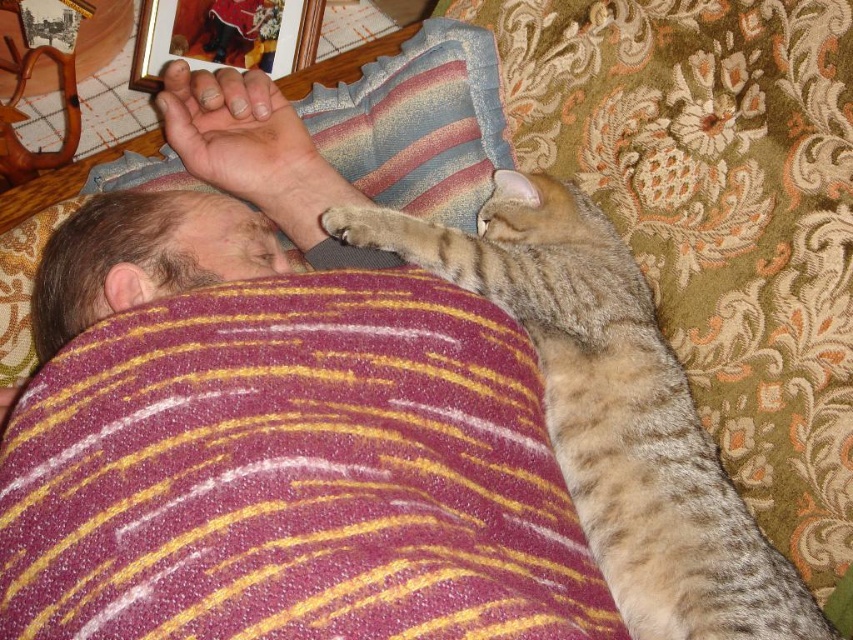
You are a photographer trying to capture a closeup shot of the tabby fur cat at upper right and the light brown fur paw at upper center. Which one should you zoom in on to ensure both are in focus without moving the camera?

The light brown fur paw at upper center is closer to the camera than the tabby fur cat at upper right. To keep both in focus, you should zoom in on the tabby fur cat at upper right since it is farther away, allowing the paw to remain in the same focal plane.

Consider the image. You are a photographer trying to capture a closeup of the tabby fur cat at upper right without the light brown fur paw at upper center blocking the view. Based on their positions, can you do this?

The tabby fur cat at upper right is in front of the light brown fur paw at upper center, so the cat will block the view of the paw. Therefore, you cannot capture a closeup of the tabby fur cat at upper right without the paw blocking the view.

Consider the image. You are a photographer trying to capture a closeup of the tabby fur cat at upper right and the light brown fur paw at upper center. Which one should you focus on first if you want to ensure both are in focus without moving the camera?

The light brown fur paw at upper center should be focused on first because the tabby fur cat at upper right is positioned to its right side, meaning the cat is farther away. By focusing on the closer object, the paw, the depth of field may include the cat as well.